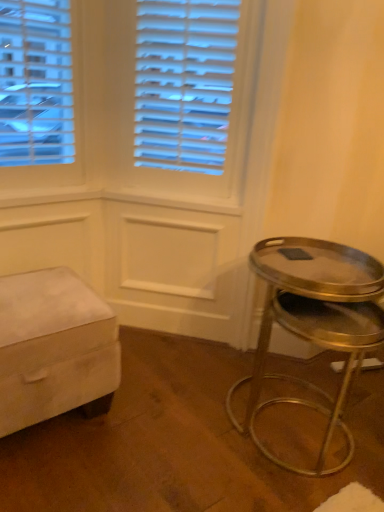
Question: From the image's perspective, is gold metallic stool at right on velvet beige ottoman at lower left?

Choices:
 (A) yes
 (B) no

Answer: (B)

Question: Are gold metallic stool at right and velvet beige ottoman at lower left far apart?

Choices:
 (A) yes
 (B) no

Answer: (B)

Question: Is gold metallic stool at right positioned beyond the bounds of velvet beige ottoman at lower left?

Choices:
 (A) yes
 (B) no

Answer: (A)

Question: From a real-world perspective, is gold metallic stool at right below velvet beige ottoman at lower left?

Choices:
 (A) yes
 (B) no

Answer: (B)

Question: Is gold metallic stool at right shorter than velvet beige ottoman at lower left?

Choices:
 (A) yes
 (B) no

Answer: (B)

Question: Could you tell me if gold metallic stool at right is turned towards velvet beige ottoman at lower left?

Choices:
 (A) no
 (B) yes

Answer: (A)

Question: From the image's perspective, would you say velvet beige ottoman at lower left is shown under gold metallic stool at right?

Choices:
 (A) no
 (B) yes

Answer: (A)

Question: Is velvet beige ottoman at lower left outside gold metallic stool at right?

Choices:
 (A) no
 (B) yes

Answer: (B)

Question: Considering the relative sizes of velvet beige ottoman at lower left and gold metallic stool at right in the image provided, is velvet beige ottoman at lower left wider than gold metallic stool at right?

Choices:
 (A) no
 (B) yes

Answer: (B)

Question: Is velvet beige ottoman at lower left beside gold metallic stool at right?

Choices:
 (A) yes
 (B) no

Answer: (B)

Question: Does velvet beige ottoman at lower left have a larger size compared to gold metallic stool at right?

Choices:
 (A) no
 (B) yes

Answer: (B)

Question: From a real-world perspective, is velvet beige ottoman at lower left below gold metallic stool at right?

Choices:
 (A) no
 (B) yes

Answer: (B)

Question: From their relative heights in the image, would you say gold metallic stool at right is taller or shorter than velvet beige ottoman at lower left?

Choices:
 (A) tall
 (B) short

Answer: (A)